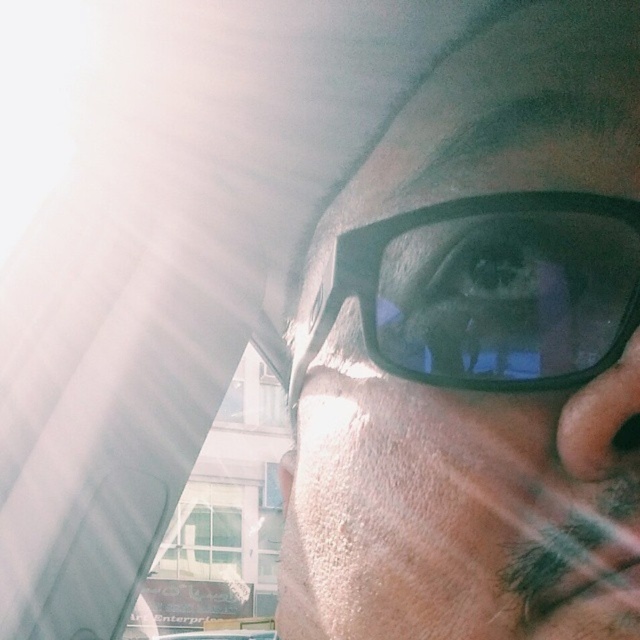
You are a photographer trying to capture a clear image of the matte black glasses at center and the black matte glasses at center in the vehicle. Since the sunlight is causing glare on the left side, how far apart are the two glasses to ensure proper framing?

The matte black glasses at center is 1.44 inches from black matte glasses at center, so you need to adjust the camera focus to account for the distance between them while managing the glare from the sunlight.

You are a passenger in a car and want to adjust your glasses to avoid the glare from the window. The matte black glasses at center are currently positioned at point 0.552 on the horizontal axis and 0.747 on the vertical axis. To reduce the glare, should you move the glasses to the left or right horizontally?

The matte black glasses at center are located at point 0.552 on the horizontal axis. Since the glare is coming from the left side of the frame, moving the glasses to the right horizontally would help reduce the glare by shifting them away from the light source.